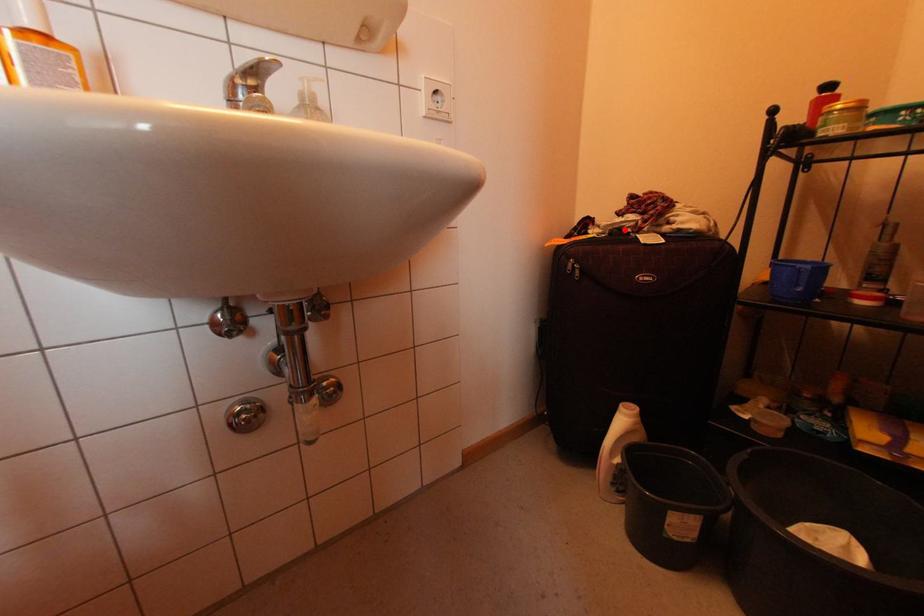
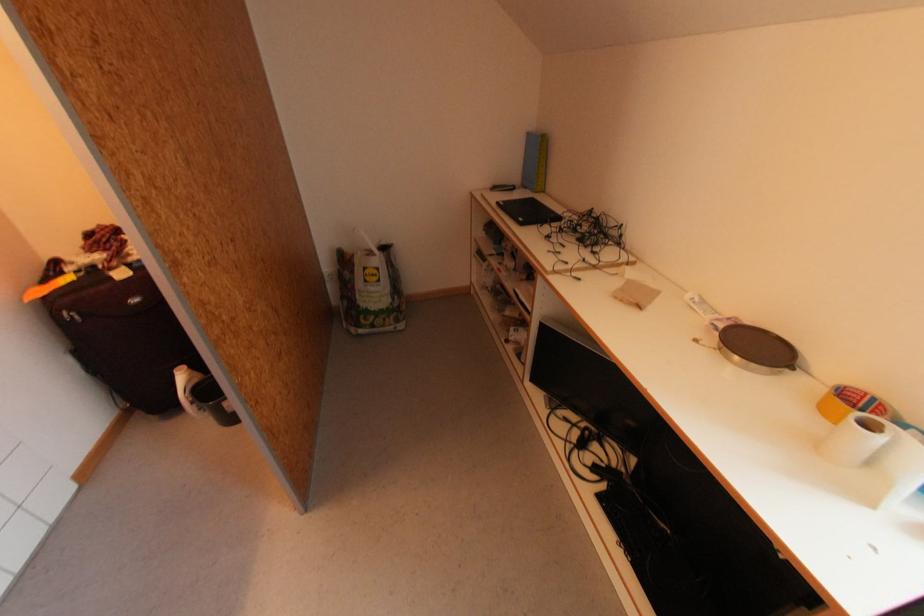
Locate, in the second image, the point that corresponds to the highlighted location in the first image.

(98, 267)